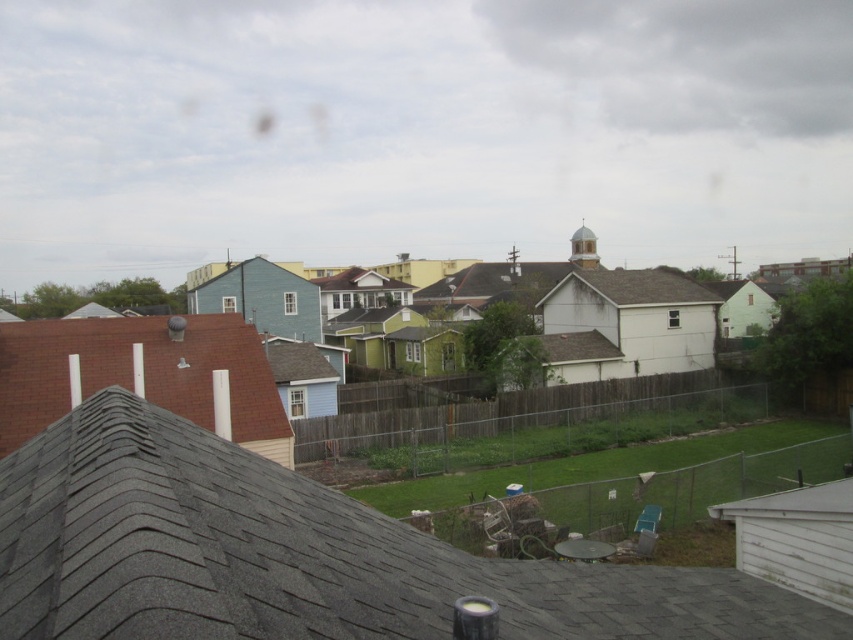
Who is more forward, (251, 504) or (102, 374)?

Point (251, 504) is in front.

Identify the location of gray shingles at center. The height and width of the screenshot is (640, 853). (299, 556).